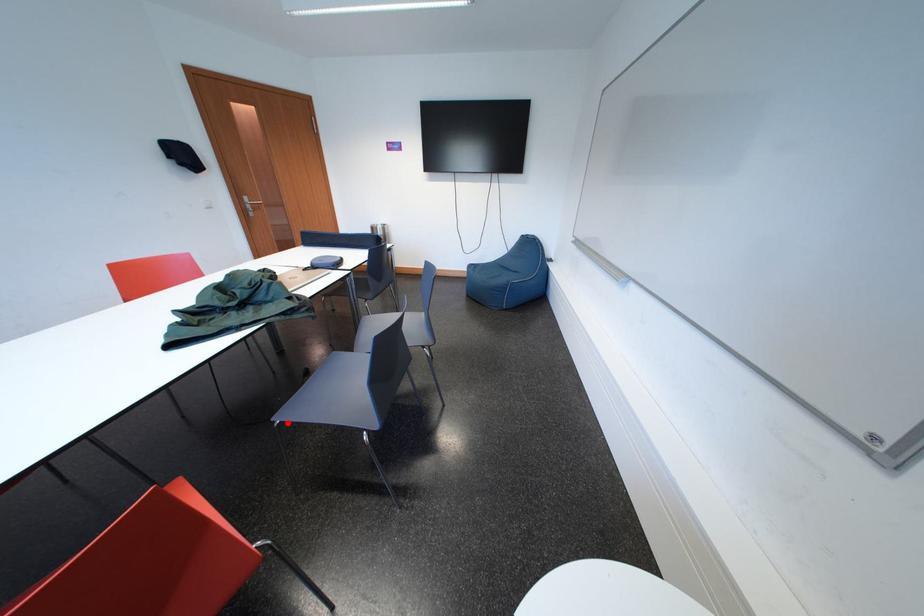
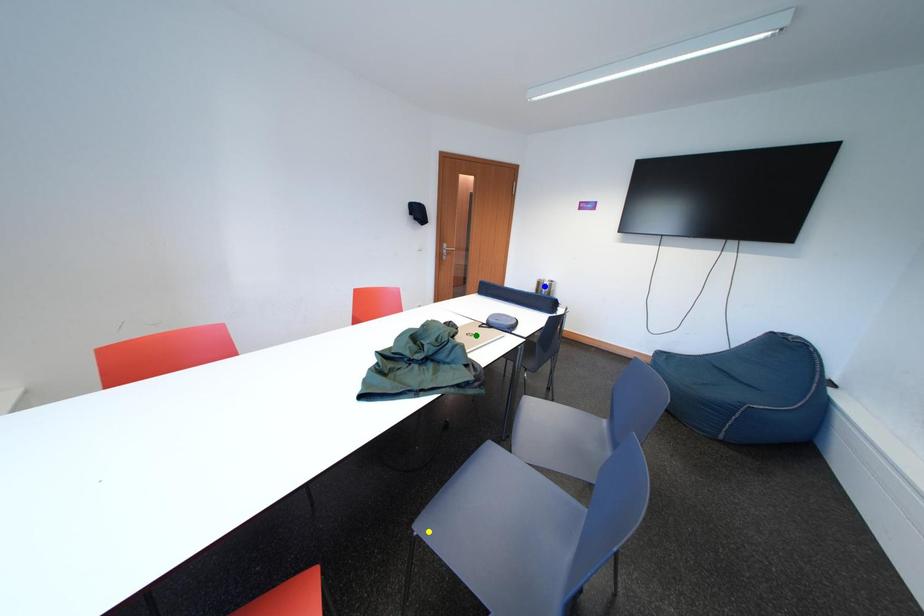
Question: I am providing you with two images of the same scene from different viewpoints. A red point is marked on the first image. You are given multiple points on the second image. Which point in image 2 represents the same 3d spot as the red point in image 1?

Choices:
 (A) yellow point
 (B) green point
 (C) blue point

Answer: (A)